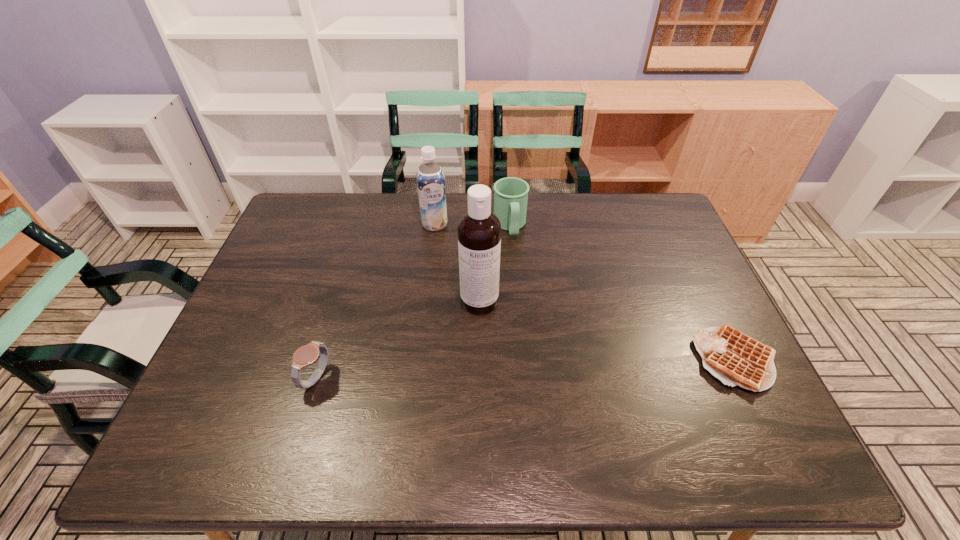
Locate an element on the screen. This screenshot has width=960, height=540. watch is located at coordinates (306, 355).

The width and height of the screenshot is (960, 540). I want to click on the leftmost object, so click(x=306, y=355).

You are a GUI agent. You are given a task and a screenshot of the screen. Output one action in this format:
    pyautogui.click(x=<x>, y=<y>)
    Task: Click on the shortest object
    This screenshot has width=960, height=540.
    Given the screenshot: What is the action you would take?
    pyautogui.click(x=734, y=358)

Identify the location of the rightmost object. The height and width of the screenshot is (540, 960). (734, 358).

Find the location of a particular element. This screenshot has height=540, width=960. the third tallest object is located at coordinates (510, 194).

Where is `the tallest object`? This screenshot has height=540, width=960. the tallest object is located at coordinates (479, 230).

Locate an element on the screen. The width and height of the screenshot is (960, 540). dishwasher detergent is located at coordinates (479, 230).

Identify the location of the fourth object from right to left. (430, 178).

Find the location of a particular element. The image size is (960, 540). the fourth shortest object is located at coordinates (430, 178).

The width and height of the screenshot is (960, 540). Find the location of `vacant point located 0.170m on the left of the watch`. vacant point located 0.170m on the left of the watch is located at coordinates [x=234, y=378].